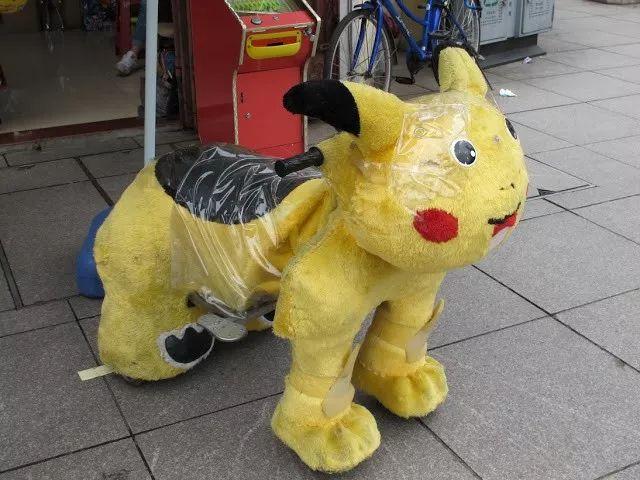
The width and height of the screenshot is (640, 480). I want to click on pinball machine, so click(253, 7).